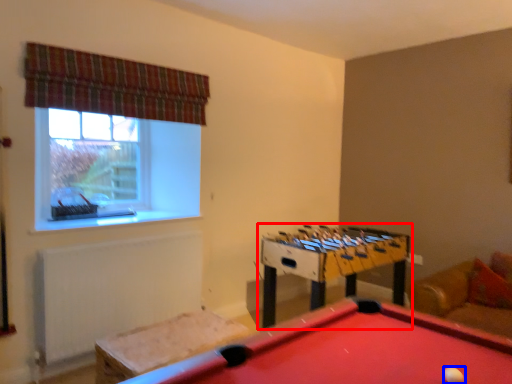
Question: Among these objects, which one is nearest to the camera, table (highlighted by a red box) or ball (highlighted by a blue box)?

Choices:
 (A) table
 (B) ball

Answer: (B)